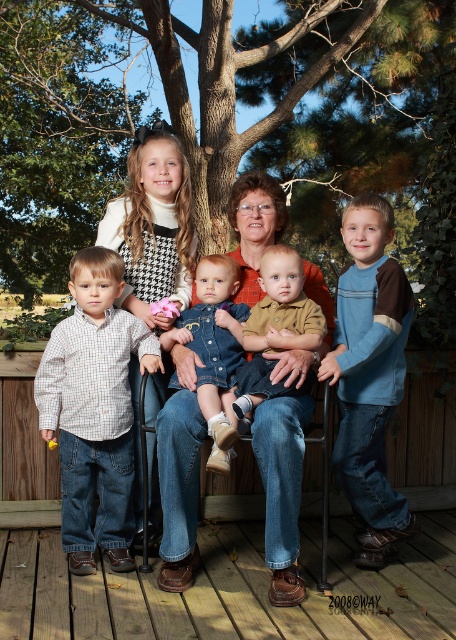
Question: Which of the following is the closest to the observer?

Choices:
 (A) pos(107,355)
 (B) pos(310,369)
 (C) pos(91,636)
 (D) pos(31,88)

Answer: (C)

Question: Based on their relative distances, which object is farther from the checkered cotton shirt at left?

Choices:
 (A) denim jacket at center
 (B) brown leather shoes at lower center

Answer: (B)

Question: Does green leafy tree at upper center have a lesser width compared to checkered cotton shirt at left?

Choices:
 (A) no
 (B) yes

Answer: (A)

Question: Can you confirm if checkered cotton shirt at left is thinner than brown denim shirt at center?

Choices:
 (A) no
 (B) yes

Answer: (A)

Question: Which point is farther to the camera?

Choices:
 (A) (140, 262)
 (B) (15, 532)

Answer: (B)

Question: Is brown leather shoes at lower center below brown denim shirt at center?

Choices:
 (A) no
 (B) yes

Answer: (B)